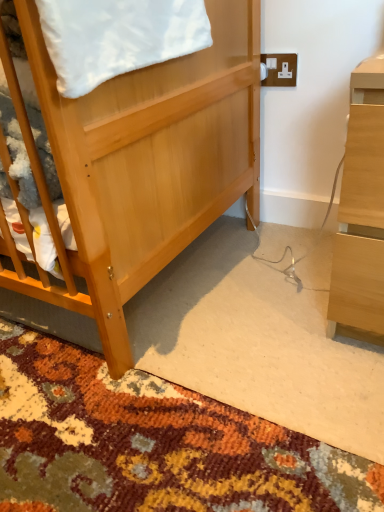
Question: Is light wood desk at right smaller than carpeted rug at center?

Choices:
 (A) no
 (B) yes

Answer: (B)

Question: Is light wood desk at right thinner than carpeted rug at center?

Choices:
 (A) no
 (B) yes

Answer: (B)

Question: From a real-world perspective, is light wood desk at right on top of carpeted rug at center?

Choices:
 (A) yes
 (B) no

Answer: (A)

Question: Does light wood desk at right have a greater width compared to carpeted rug at center?

Choices:
 (A) yes
 (B) no

Answer: (B)

Question: Is light wood desk at right not inside carpeted rug at center?

Choices:
 (A) yes
 (B) no

Answer: (A)

Question: Considering the relative sizes of light wood desk at right and carpeted rug at center in the image provided, is light wood desk at right shorter than carpeted rug at center?

Choices:
 (A) yes
 (B) no

Answer: (B)

Question: Can you confirm if white soft blanket at upper left is positioned to the right of carpeted rug at center?

Choices:
 (A) no
 (B) yes

Answer: (A)

Question: From the image's perspective, is white soft blanket at upper left beneath carpeted rug at center?

Choices:
 (A) yes
 (B) no

Answer: (B)

Question: From the image's perspective, is white soft blanket at upper left on top of carpeted rug at center?

Choices:
 (A) yes
 (B) no

Answer: (A)

Question: From a real-world perspective, is white soft blanket at upper left physically below carpeted rug at center?

Choices:
 (A) yes
 (B) no

Answer: (B)

Question: Is white soft blanket at upper left bigger than carpeted rug at center?

Choices:
 (A) yes
 (B) no

Answer: (B)

Question: Could you tell me if white soft blanket at upper left is facing carpeted rug at center?

Choices:
 (A) yes
 (B) no

Answer: (B)

Question: From the image's perspective, is white plastic electric outlet at upper right on light wood desk at right?

Choices:
 (A) no
 (B) yes

Answer: (B)